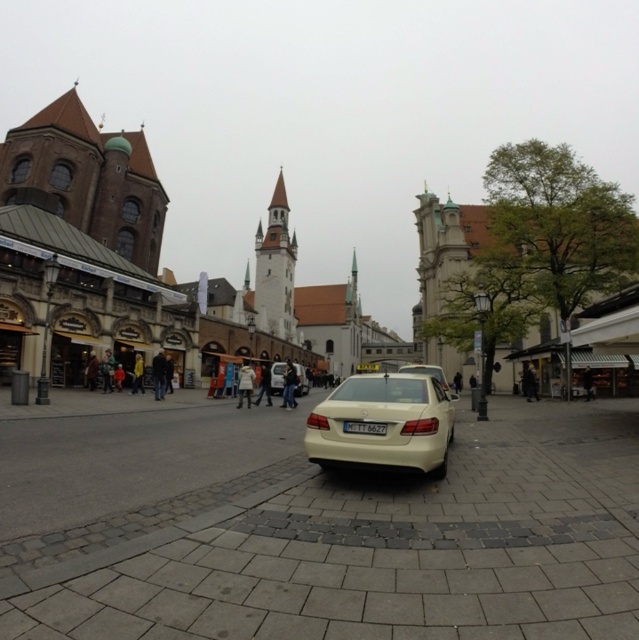
Question: Which point is closer to the camera?

Choices:
 (A) white glossy car at center
 (B) black leather jacket at center

Answer: (A)

Question: Is white fabric jacket at center to the left of white matte sedan at center from the viewer's perspective?

Choices:
 (A) no
 (B) yes

Answer: (B)

Question: Which object is farther from the camera taking this photo?

Choices:
 (A) white cotton coat at center
 (B) dark blue jeans at center
 (C) black leather jacket at center

Answer: (C)

Question: Which of these objects is positioned closest to the matte beige sedan at center?

Choices:
 (A) white glossy car at center
 (B) white fabric jacket at center
 (C) black plastic license plate at center
 (D) black leather jacket at center

Answer: (C)

Question: Is metallic silver sedan at center closer to the viewer compared to black plastic license plate at center?

Choices:
 (A) no
 (B) yes

Answer: (A)

Question: Is matte beige sedan at center positioned behind white matte sedan at center?

Choices:
 (A) yes
 (B) no

Answer: (B)